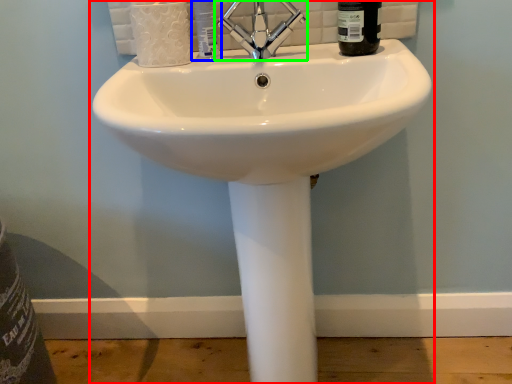
Question: Estimate the real-world distances between objects in this image. Which object is farther from sink (highlighted by a red box), toiletry (highlighted by a blue box) or tap (highlighted by a green box)?

Choices:
 (A) toiletry
 (B) tap

Answer: (A)